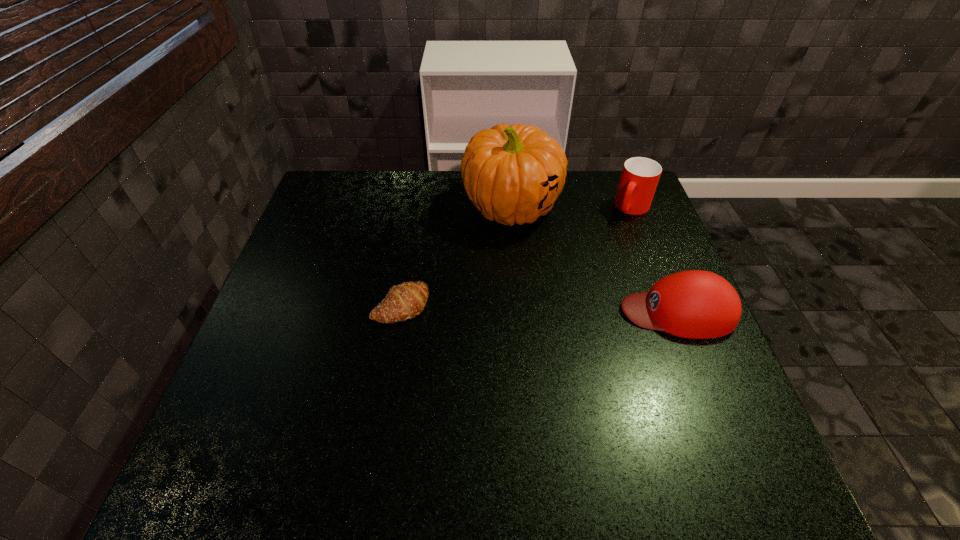
Identify the location of free space between the cup and the shortest object. (516, 256).

At what (x,y) coordinates should I click in order to perform the action: click on vacant area that lies between the second object from left to right and the second shortest object. Please return your answer as a coordinate pair (x, y). The height and width of the screenshot is (540, 960). Looking at the image, I should click on (594, 259).

This screenshot has height=540, width=960. Identify the location of free space between the third shortest object and the baseball cap. (655, 259).

Find the location of a particular element. This screenshot has width=960, height=540. unoccupied position between the baseball cap and the leftmost object is located at coordinates (540, 308).

Locate an element on the screen. The height and width of the screenshot is (540, 960). unoccupied area between the second shortest object and the crescent roll is located at coordinates (540, 308).

Find the location of a particular element. blank region between the third shortest object and the baseball cap is located at coordinates [655, 259].

Point out which object is positioned as the second nearest to the third shortest object. Please provide its 2D coordinates. Your answer should be formatted as a tuple, i.e. [(x, y)], where the tuple contains the x and y coordinates of a point satisfying the conditions above.

[(695, 304)]

Where is `the second closest object relative to the third shortest object`? the second closest object relative to the third shortest object is located at coordinates (695, 304).

Where is `free space that satisfies the following two spatial constraints: 1. on the front side of the second shortest object; 2. on the front-facing side of the second object from left to right`? The height and width of the screenshot is (540, 960). free space that satisfies the following two spatial constraints: 1. on the front side of the second shortest object; 2. on the front-facing side of the second object from left to right is located at coordinates (520, 311).